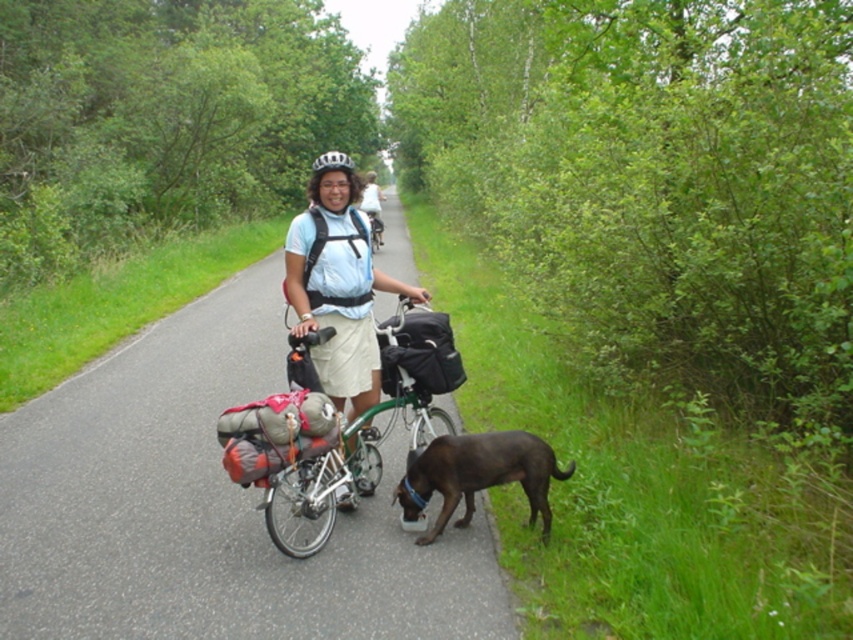
Is matte white shirt at center smaller than white matte bicycle helmet at center?

Indeed, matte white shirt at center has a smaller size compared to white matte bicycle helmet at center.

Is matte white shirt at center to the right of white matte bicycle helmet at center from the viewer's perspective?

Indeed, matte white shirt at center is positioned on the right side of white matte bicycle helmet at center.

Locate an element on the screen. The image size is (853, 640). matte white shirt at center is located at coordinates (338, 289).

Is green asphalt road at center bigger than matte white shirt at center?

Yes, green asphalt road at center is bigger than matte white shirt at center.

Image resolution: width=853 pixels, height=640 pixels. What do you see at coordinates (206, 506) in the screenshot?
I see `green asphalt road at center` at bounding box center [206, 506].

Between point (164, 404) and point (320, 180), which one is positioned behind?

Positioned behind is point (164, 404).

Identify the location of green asphalt road at center. The height and width of the screenshot is (640, 853). tap(206, 506).

Can you confirm if matte white shirt at center is positioned to the right of brown matte dog at lower center?

In fact, matte white shirt at center is to the left of brown matte dog at lower center.

Between point (352, 212) and point (471, 458), which one is positioned behind?

Positioned behind is point (352, 212).

At what (x,y) coordinates should I click in order to perform the action: click on matte white shirt at center. Please return your answer as a coordinate pair (x, y). Looking at the image, I should click on (338, 289).